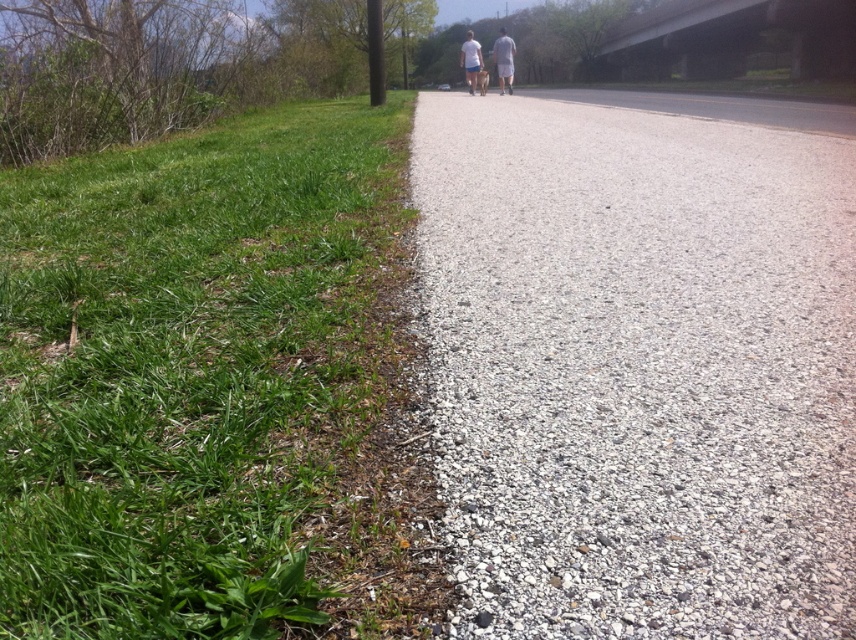
You are standing at point (x=504, y=36) and want to walk towards point (x=259, y=605). According to the scene, which direction should you move relative to the path?

You should move towards the direction of the path since point (x=259, y=605) is in front of point (x=504, y=36) along the path.